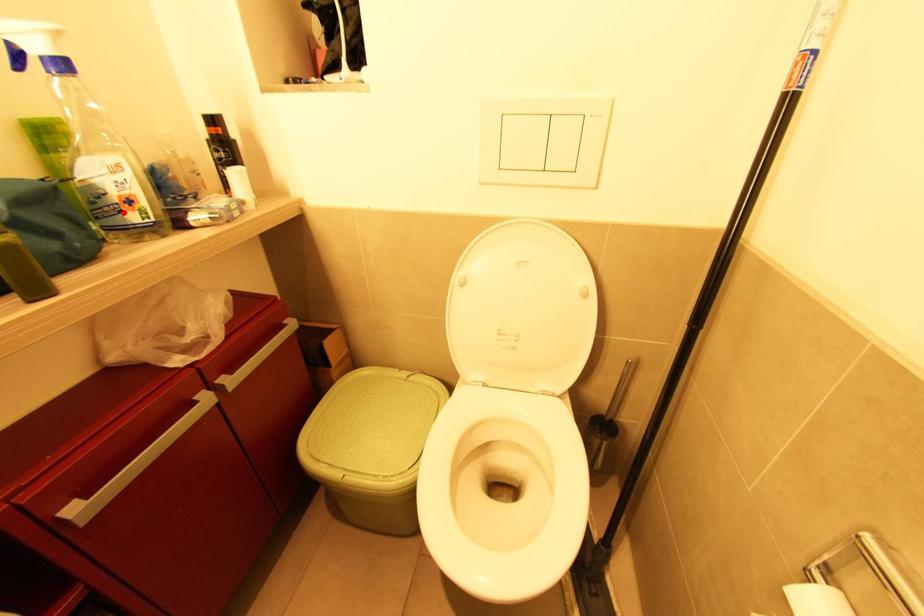
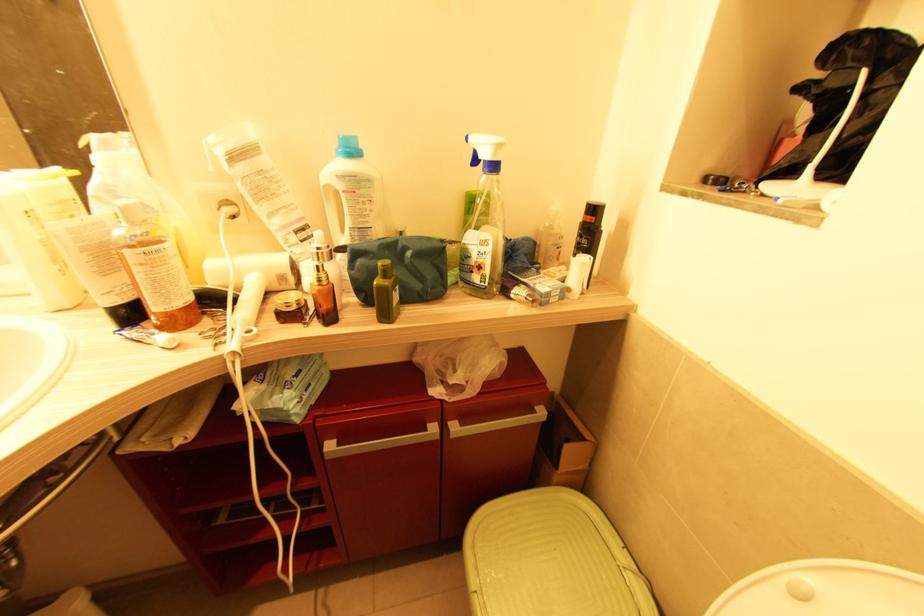
Locate, in the second image, the point that corresponds to the highlighted location in the first image.

(473, 273)